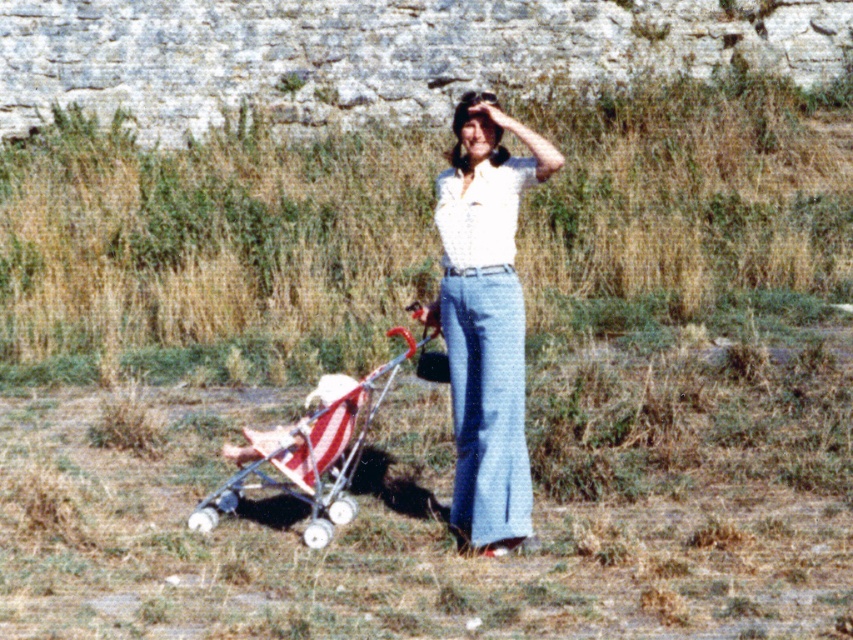
You are a photographer trying to capture the stroller in the image. The stroller is located at point (x=315, y=448). If you want to focus on the stroller, should you adjust your camera to the left or right of the current position?

The point (x=315, y=448) marks the red striped fabric stroller at lower left, so you should adjust your camera to the right to focus on it.

You are a photographer taking a portrait of the woman in the white cotton blouse at center. To ensure the blouse is in focus, where should you aim the camera lens?

You should aim the camera lens at point (486,320) to ensure the white cotton blouse at center is in focus.

You are a photographer trying to capture a photo of the white cotton blouse at center and the red striped fabric stroller at lower left. Which object should you focus on first if you want to include both in the frame without moving the camera?

You should focus on the white cotton blouse at center first because it occupies less space than the red striped fabric stroller at lower left, so it will be easier to fit both into the frame by prioritizing the smaller object.